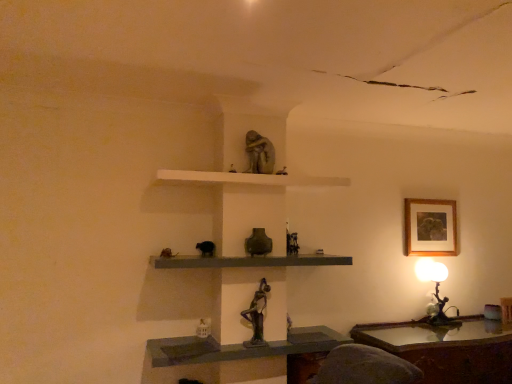
Identify the location of vacant space situated on the left part of metallic bronze figurine at right. click(424, 327).